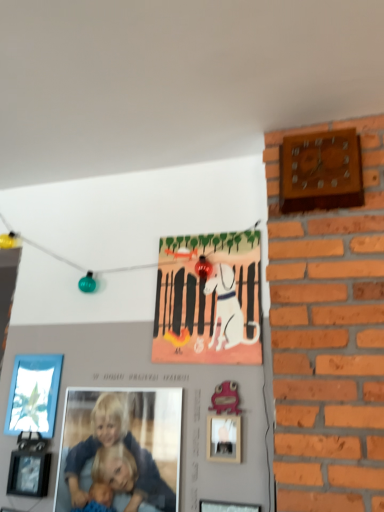
Question: Considering the relative positions of wooden wall clock at upper right and pink matte picture frame at center, marked as the 3th picture frame in a back-to-front arrangement, in the image provided, is wooden wall clock at upper right to the right of pink matte picture frame at center, marked as the 3th picture frame in a back-to-front arrangement, from the viewer's perspective?

Choices:
 (A) yes
 (B) no

Answer: (A)

Question: From a real-world perspective, is wooden wall clock at upper right under pink matte picture frame at center, the fourth picture frame in the left-to-right sequence?

Choices:
 (A) yes
 (B) no

Answer: (B)

Question: Is wooden wall clock at upper right turned away from pink matte picture frame at center, marked as the 3th picture frame in a back-to-front arrangement?

Choices:
 (A) no
 (B) yes

Answer: (A)

Question: From the image's perspective, is wooden wall clock at upper right beneath pink matte picture frame at center, marked as the 3th picture frame in a back-to-front arrangement?

Choices:
 (A) no
 (B) yes

Answer: (A)

Question: Would you say pink matte picture frame at center, the fourth picture frame in the left-to-right sequence, is part of wooden wall clock at upper right's contents?

Choices:
 (A) yes
 (B) no

Answer: (B)

Question: Is the depth of wooden wall clock at upper right less than that of pink matte picture frame at center, the fourth picture frame in the left-to-right sequence?

Choices:
 (A) no
 (B) yes

Answer: (B)

Question: Is pink matte picture frame at center, the fourth picture frame in the left-to-right sequence, not inside wooden wall clock at upper right?

Choices:
 (A) no
 (B) yes

Answer: (B)

Question: Could wooden wall clock at upper right be considered to be inside pink matte picture frame at center, the 1th picture frame from the right?

Choices:
 (A) no
 (B) yes

Answer: (A)

Question: Can you confirm if pink matte picture frame at center, which is the second picture frame in front-to-back order, is bigger than wooden wall clock at upper right?

Choices:
 (A) yes
 (B) no

Answer: (B)

Question: Is pink matte picture frame at center, which is the second picture frame in front-to-back order, not near wooden wall clock at upper right?

Choices:
 (A) yes
 (B) no

Answer: (B)

Question: Is pink matte picture frame at center, the 1th picture frame from the right, in contact with wooden wall clock at upper right?

Choices:
 (A) yes
 (B) no

Answer: (B)

Question: Is pink matte picture frame at center, the 1th picture frame from the right, closer to camera compared to wooden wall clock at upper right?

Choices:
 (A) no
 (B) yes

Answer: (A)

Question: Considering the relative sizes of matte glass picture frame at lower left, the fourth picture frame positioned from the right, and wooden wall clock at upper right in the image provided, is matte glass picture frame at lower left, the fourth picture frame positioned from the right, shorter than wooden wall clock at upper right?

Choices:
 (A) no
 (B) yes

Answer: (B)